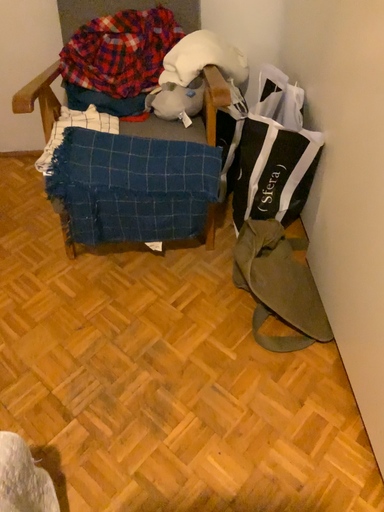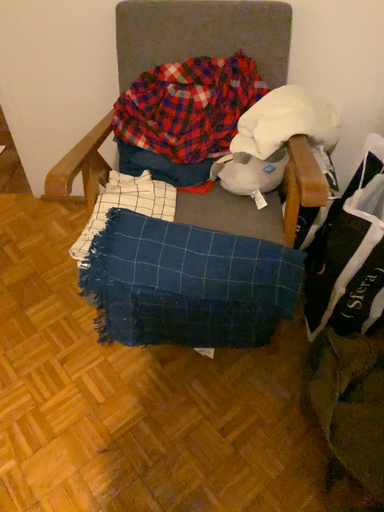
Question: How did the camera likely rotate when shooting the video?

Choices:
 (A) rotated left
 (B) rotated right

Answer: (A)